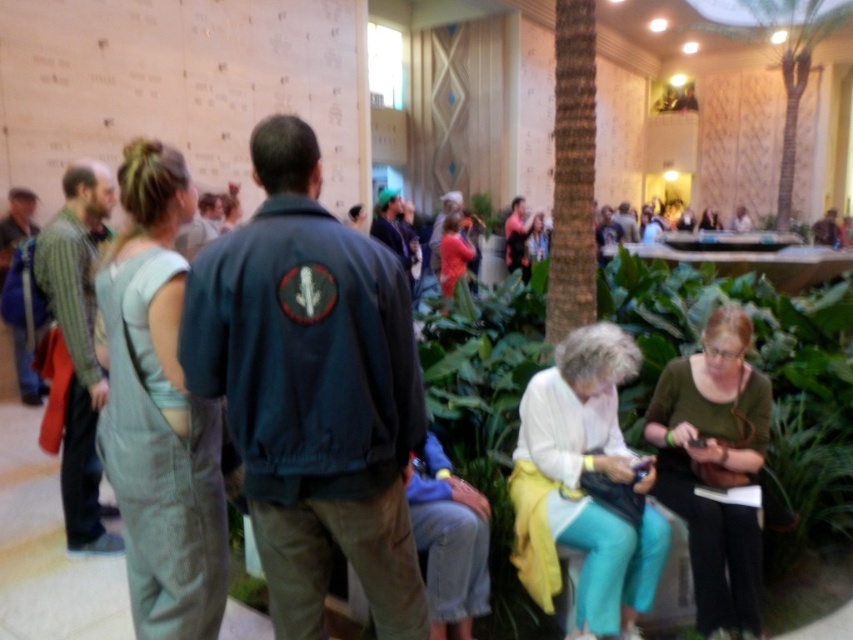
You are a photographer carrying a matte black camera at center. You want to take a photo of the light blue denim overalls at left. Can you capture the entire subject in your shot without moving closer? Explain your reasoning based on the distance provided.

The distance between the light blue denim overalls at left and the matte black camera at center is 8.32 meters. Whether the entire subject can be captured depends on the camera lens used. A standard lens might struggle at this distance, but a telephoto lens could potentially capture the overalls without moving closer.

What is the color of the clothing item located at the coordinates point (160, 412)?

The clothing item at point (160, 412) is light blue denim overalls.

You are a photographer at the event and need to adjust your matte black camera at center. You notice a green fabric purse at lower right nearby. Which object is closer to you, the photographer, when you look towards them?

The green fabric purse at lower right is closer to the photographer than the matte black camera at center.